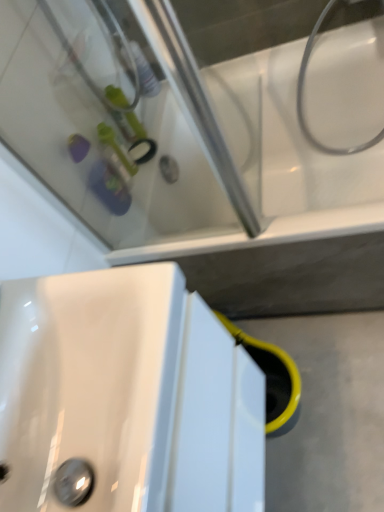
Question: Considering the positions of white glossy sink at lower left and white glossy hose at upper right in the image, is white glossy sink at lower left wider or thinner than white glossy hose at upper right?

Choices:
 (A) wide
 (B) thin

Answer: (A)

Question: From a real-world perspective, relative to white glossy hose at upper right, is white glossy sink at lower left vertically above or below?

Choices:
 (A) below
 (B) above

Answer: (B)

Question: Which object is the closest to the white glossy hose at upper right?

Choices:
 (A) white glossy sink at lower left
 (B) white glossy bathtub at upper center

Answer: (B)

Question: Estimate the real-world distances between objects in this image. Which object is closer to the white glossy bathtub at upper center?

Choices:
 (A) white glossy sink at lower left
 (B) white glossy hose at upper right

Answer: (B)